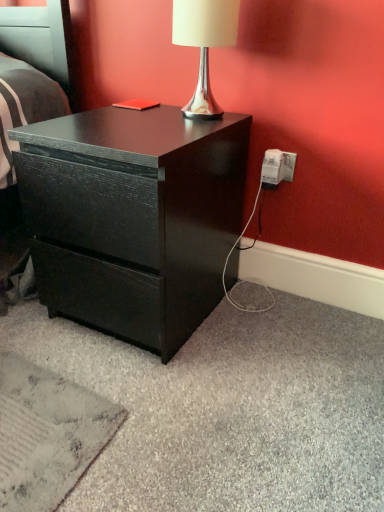
Question: Does matte black drawer at center touch silver metallic lamp at upper center?

Choices:
 (A) yes
 (B) no

Answer: (B)

Question: Is matte black drawer at center closer to the viewer compared to silver metallic lamp at upper center?

Choices:
 (A) yes
 (B) no

Answer: (A)

Question: Can you confirm if matte black drawer at center is smaller than silver metallic lamp at upper center?

Choices:
 (A) yes
 (B) no

Answer: (B)

Question: Is the position of matte black drawer at center more distant than that of silver metallic lamp at upper center?

Choices:
 (A) no
 (B) yes

Answer: (A)

Question: Is matte black drawer at center not within silver metallic lamp at upper center?

Choices:
 (A) no
 (B) yes

Answer: (B)

Question: Is matte black drawer at center wider than silver metallic lamp at upper center?

Choices:
 (A) yes
 (B) no

Answer: (A)

Question: Does matte black drawer at center appear on the right side of white plastic power outlet at lower right?

Choices:
 (A) yes
 (B) no

Answer: (B)

Question: Could you tell me if matte black drawer at center is facing white plastic power outlet at lower right?

Choices:
 (A) no
 (B) yes

Answer: (A)

Question: Is matte black drawer at center shorter than white plastic power outlet at lower right?

Choices:
 (A) yes
 (B) no

Answer: (B)

Question: Is matte black drawer at center directly adjacent to white plastic power outlet at lower right?

Choices:
 (A) no
 (B) yes

Answer: (A)

Question: Considering the relative sizes of matte black drawer at center and white plastic power outlet at lower right in the image provided, is matte black drawer at center smaller than white plastic power outlet at lower right?

Choices:
 (A) yes
 (B) no

Answer: (B)

Question: From the image's perspective, does matte black drawer at center appear lower than white plastic power outlet at lower right?

Choices:
 (A) yes
 (B) no

Answer: (A)

Question: From the image's perspective, is silver metallic lamp at upper center located above matte black drawer at center?

Choices:
 (A) no
 (B) yes

Answer: (B)